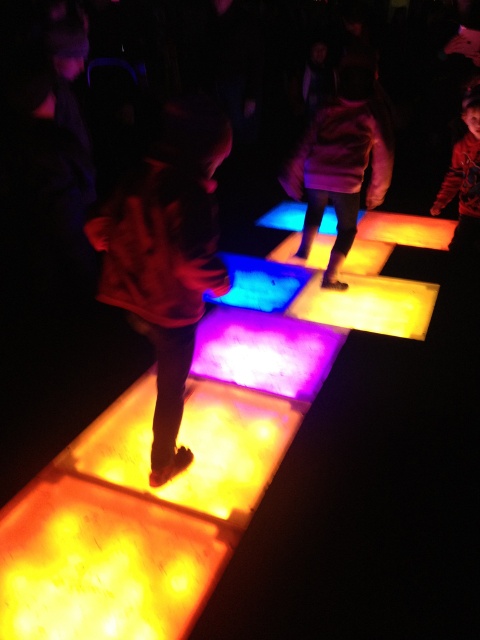
Which is more to the left, matte orange square at center or matte purple sweater at center?

matte orange square at center

Who is higher up, matte orange square at center or matte purple sweater at center?

Positioned higher is matte purple sweater at center.

Is point (158, 396) less distant than point (350, 188)?

That is True.

The height and width of the screenshot is (640, 480). Identify the location of matte orange square at center. point(167,256).

Is translucent glowing square at center closer to camera compared to matte purple sweater at center?

Yes, translucent glowing square at center is closer to the viewer.

Is point (222, 403) less distant than point (304, 228)?

Yes, point (222, 403) is in front of point (304, 228).

Is point (152, 630) farther from camera compared to point (326, 275)?

No, (152, 630) is closer to viewer.

Identify the location of translucent glowing square at center. (155, 496).

In the scene shown: Who is positioned more to the right, translucent glowing square at center or matte orange square at center?

From the viewer's perspective, translucent glowing square at center appears more on the right side.

What do you see at coordinates (155, 496) in the screenshot?
I see `translucent glowing square at center` at bounding box center [155, 496].

Is point (323, 312) less distant than point (160, 403)?

No, (323, 312) is further to viewer.

Locate an element on the screen. The image size is (480, 640). translucent glowing square at center is located at coordinates (155, 496).